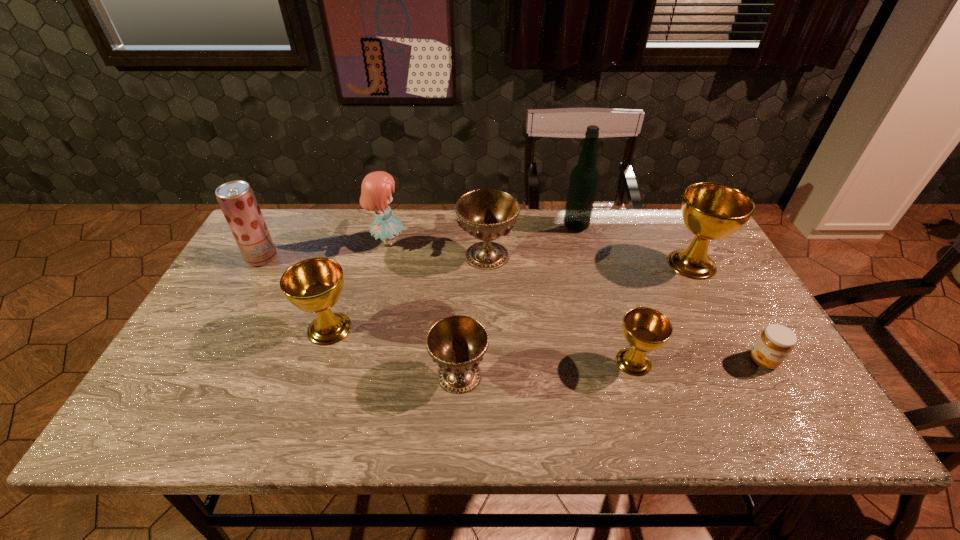
You are a GUI agent. You are given a task and a screenshot of the screen. Output one action in this format:
    pyautogui.click(x=<x>, y=<y>)
    Task: Click on the free space located 0.300m on the right of the second smallest gold chalice
    This screenshot has width=960, height=540.
    Given the screenshot: What is the action you would take?
    pyautogui.click(x=474, y=329)

This screenshot has width=960, height=540. What are the coordinates of `vacant space located 0.220m on the back of the second chalice from right to left` in the screenshot? It's located at (610, 283).

I want to click on vacant space located 0.300m on the back of the smaller red chalice, so click(464, 269).

The image size is (960, 540). I want to click on blank area located 0.120m on the front label of the orange jam, so click(798, 420).

Find the location of `alcohol present at the far edge`. alcohol present at the far edge is located at coordinates (584, 177).

You are a GUI agent. You are given a task and a screenshot of the screen. Output one action in this format:
    pyautogui.click(x=<x>, y=<y>)
    Task: Click on the fruit juice that is at the far edge
    The image size is (960, 540).
    Given the screenshot: What is the action you would take?
    pyautogui.click(x=236, y=199)

Image resolution: width=960 pixels, height=540 pixels. I want to click on doll present at the far edge, so click(376, 190).

Locate an element on the screen. The image size is (960, 540). object that is at the near edge is located at coordinates (457, 343).

Locate an element on the screen. The image size is (960, 540). object at the left edge is located at coordinates (236, 199).

Identify the location of chalice present at the right edge. This screenshot has height=540, width=960. (711, 211).